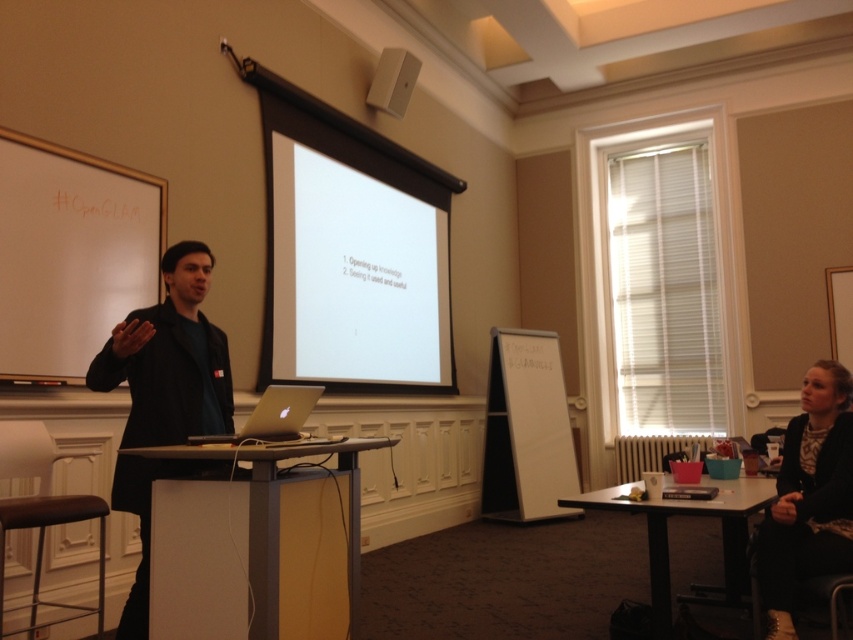
Consider the image. Which of these two, white glossy table at center or black textured sweater at lower right, stands shorter?

Standing shorter between the two is white glossy table at center.

Which is in front, point (171, 529) or point (788, 557)?

Point (171, 529) is in front.

Does point (338, 516) lie in front of point (827, 483)?

Yes, it is.

The width and height of the screenshot is (853, 640). Find the location of `white glossy table at center`. white glossy table at center is located at coordinates (256, 544).

Can you confirm if white matte projection screen at center is positioned to the right of matte plastic table at lower right?

Incorrect, white matte projection screen at center is not on the right side of matte plastic table at lower right.

Does white matte projection screen at center come in front of matte plastic table at lower right?

No, it is not.

Who is more distant from viewer, [368,205] or [660,566]?

Positioned behind is point [368,205].

At what (x,y) coordinates should I click in order to perform the action: click on white matte projection screen at center. Please return your answer as a coordinate pair (x, y). Looking at the image, I should click on (354, 273).

Is white matte projection screen at center positioned in front of silver metallic laptop at center?

No, white matte projection screen at center is further to the viewer.

Does white matte projection screen at center appear on the left side of silver metallic laptop at center?

In fact, white matte projection screen at center is to the right of silver metallic laptop at center.

This screenshot has height=640, width=853. What do you see at coordinates (354, 273) in the screenshot? I see `white matte projection screen at center` at bounding box center [354, 273].

Identify the location of white matte projection screen at center. (354, 273).